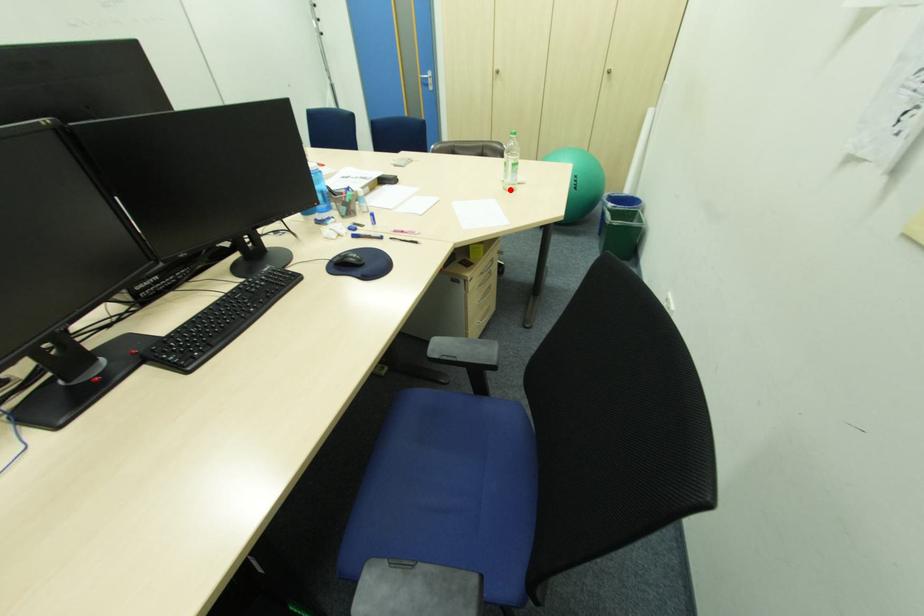
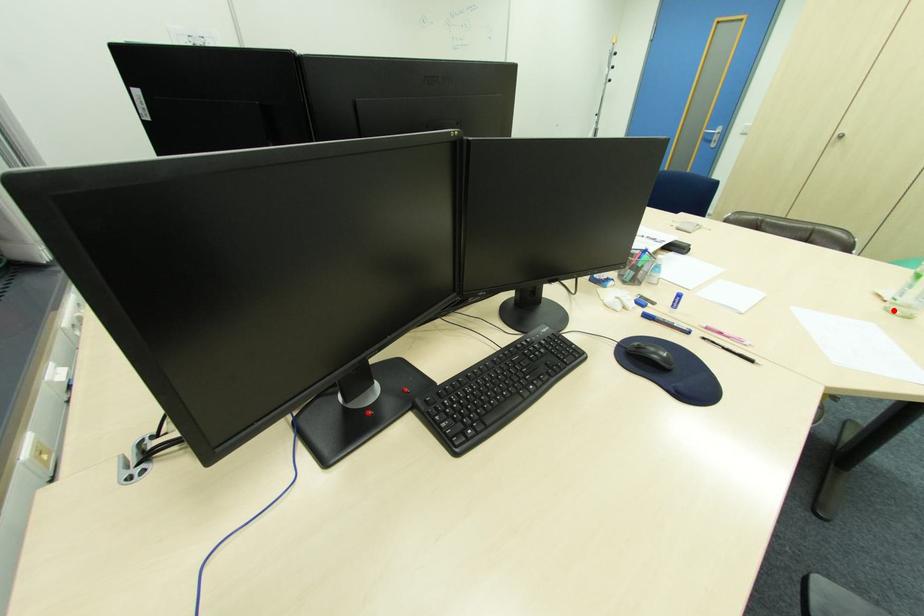
I am providing you with two images of the same scene from different viewpoints. A red point is marked on the first image and another point is marked on the second image. Does the point marked in image1 correspond to the same location as the one in image2?

Yes